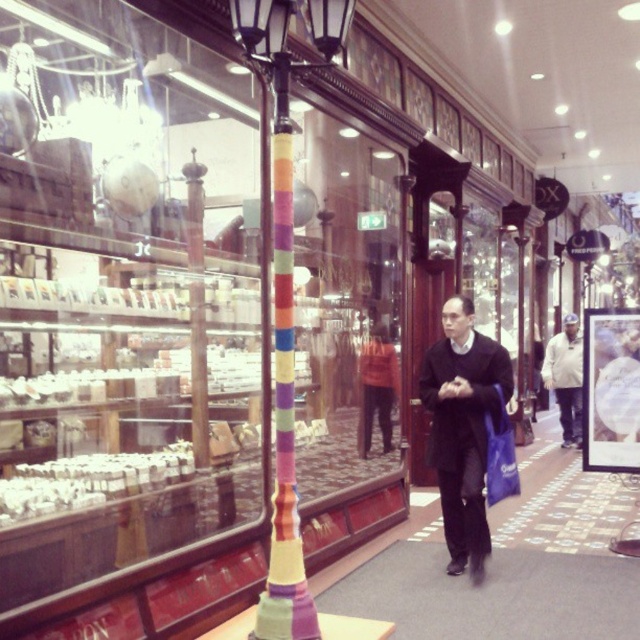
Question: Considering the relative positions of carpeted floor at center and white matte jacket at center in the image provided, where is carpeted floor at center located with respect to white matte jacket at center?

Choices:
 (A) left
 (B) right

Answer: (A)

Question: Does matte black coat at center appear on the right side of multicolored fabric pole at center?

Choices:
 (A) yes
 (B) no

Answer: (A)

Question: Which point is closer to the camera?

Choices:
 (A) (497, 456)
 (B) (275, 380)

Answer: (B)

Question: Which of the following is the closest to the observer?

Choices:
 (A) matte blue shopping bag at center-right
 (B) multicolored yarn wrapped pole at center
 (C) matte black coat at center
 (D) carpeted floor at center

Answer: (B)

Question: Is multicolored yarn wrapped pole at center closer to camera compared to white matte jacket at center?

Choices:
 (A) yes
 (B) no

Answer: (A)

Question: Which of the following is the closest to the observer?

Choices:
 (A) matte black coat at center
 (B) carpeted floor at center

Answer: (B)